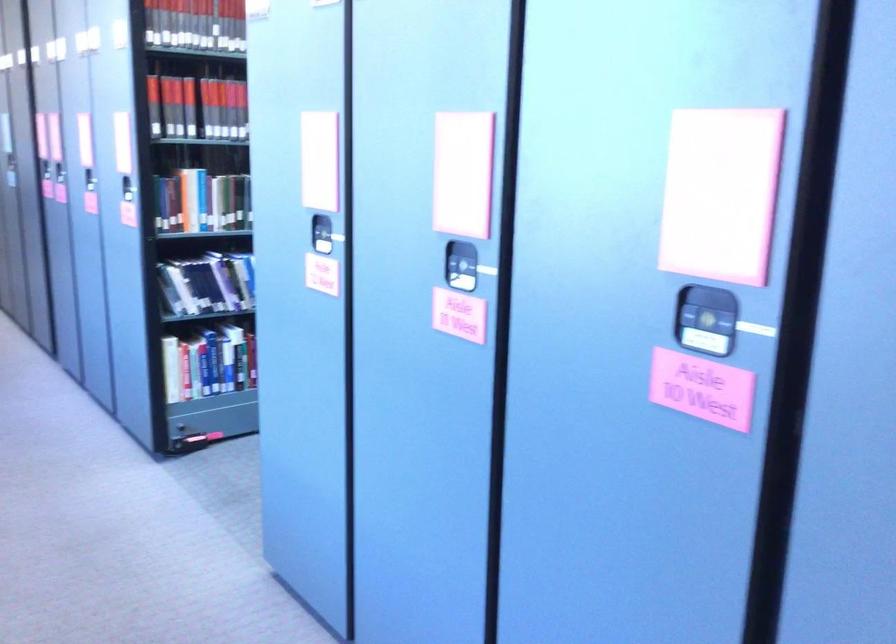
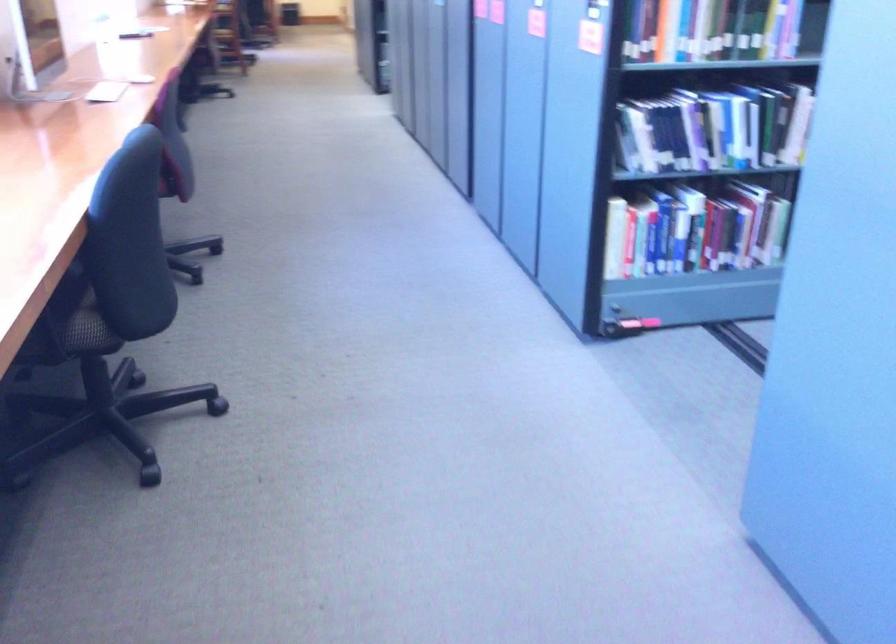
In the second image, find the point that corresponds to (209,283) in the first image.

(673, 135)